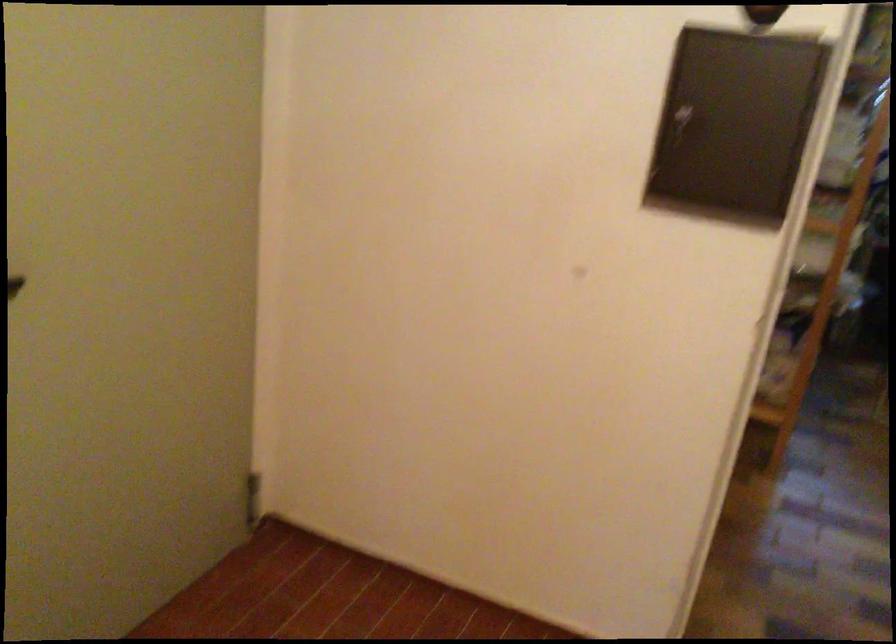
Question: How did the camera likely rotate?

Choices:
 (A) Left
 (B) Right
 (C) Up
 (D) Down

Answer: (A)